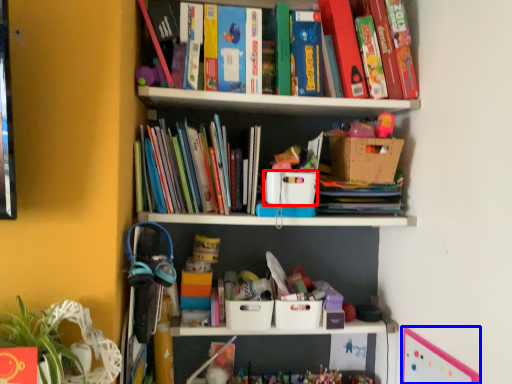
Question: Which point is further to the camera, storage box (highlighted by a red box) or bulletin board (highlighted by a blue box)?

Choices:
 (A) storage box
 (B) bulletin board

Answer: (A)